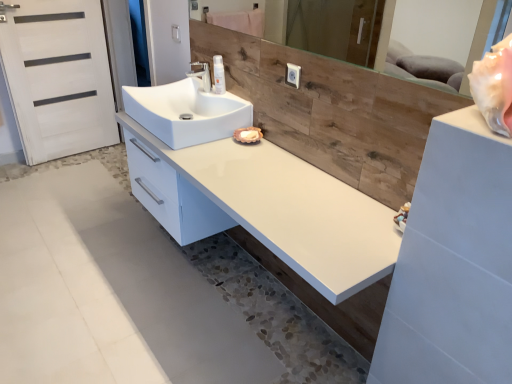
The width and height of the screenshot is (512, 384). I want to click on vacant space underneath wooden mirror at upper center (from a real-world perspective), so click(260, 261).